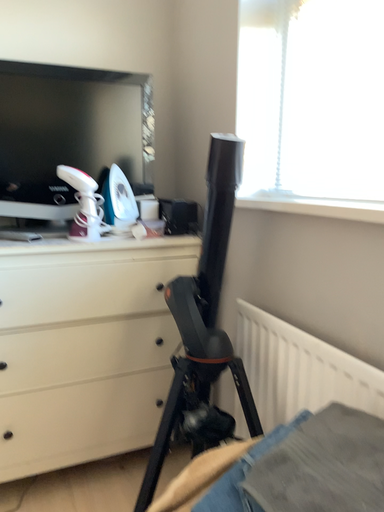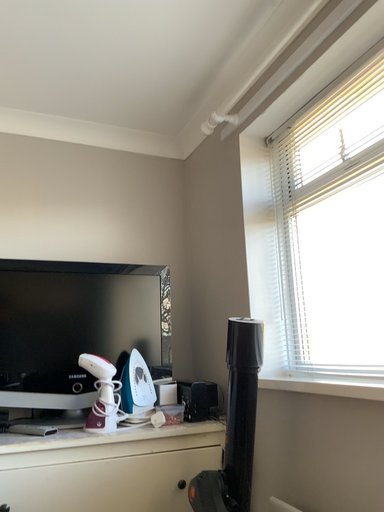
Question: Which way did the camera rotate in the video?

Choices:
 (A) rotated downward
 (B) rotated upward

Answer: (B)